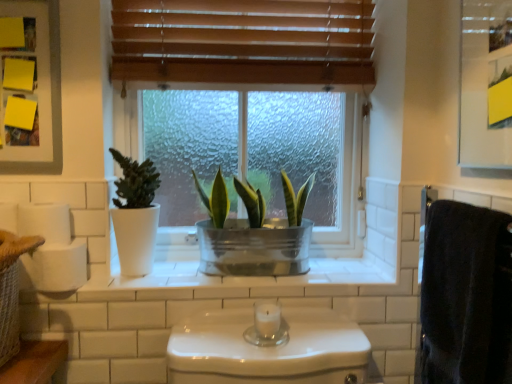
Question: From the image's perspective, is metallic silver medicine cabinet at upper right, acting as the 1th medicine cabinet starting from the right, on white matte toilet paper at left?

Choices:
 (A) no
 (B) yes

Answer: (B)

Question: Considering the relative positions of metallic silver medicine cabinet at upper right, marked as the second medicine cabinet in a back-to-front arrangement, and white matte toilet paper at left in the image provided, is metallic silver medicine cabinet at upper right, marked as the second medicine cabinet in a back-to-front arrangement, to the left of white matte toilet paper at left from the viewer's perspective?

Choices:
 (A) yes
 (B) no

Answer: (B)

Question: Considering the relative sizes of metallic silver medicine cabinet at upper right, marked as the second medicine cabinet in a back-to-front arrangement, and white matte toilet paper at left in the image provided, is metallic silver medicine cabinet at upper right, marked as the second medicine cabinet in a back-to-front arrangement, smaller than white matte toilet paper at left?

Choices:
 (A) yes
 (B) no

Answer: (B)

Question: Is metallic silver medicine cabinet at upper right, which is counted as the first medicine cabinet, starting from the front, positioned before white matte toilet paper at left?

Choices:
 (A) no
 (B) yes

Answer: (B)

Question: From a real-world perspective, is metallic silver medicine cabinet at upper right, which is counted as the first medicine cabinet, starting from the front, physically above white matte toilet paper at left?

Choices:
 (A) yes
 (B) no

Answer: (A)

Question: Does metallic silver medicine cabinet at upper right, acting as the 1th medicine cabinet starting from the right, have a greater height compared to white matte toilet paper at left?

Choices:
 (A) yes
 (B) no

Answer: (A)

Question: From a real-world perspective, does yellow paper at upper left, marked as the first medicine cabinet in a left-to-right arrangement, stand above white matte toilet paper at left?

Choices:
 (A) no
 (B) yes

Answer: (B)

Question: Considering the relative sizes of yellow paper at upper left, arranged as the first medicine cabinet when viewed from the back, and white matte toilet paper at left in the image provided, is yellow paper at upper left, arranged as the first medicine cabinet when viewed from the back, thinner than white matte toilet paper at left?

Choices:
 (A) yes
 (B) no

Answer: (A)

Question: Considering the relative sizes of yellow paper at upper left, arranged as the first medicine cabinet when viewed from the back, and white matte toilet paper at left in the image provided, is yellow paper at upper left, arranged as the first medicine cabinet when viewed from the back, wider than white matte toilet paper at left?

Choices:
 (A) no
 (B) yes

Answer: (A)

Question: Is white matte toilet paper at left located within yellow paper at upper left, arranged as the first medicine cabinet when viewed from the back?

Choices:
 (A) yes
 (B) no

Answer: (B)

Question: From the image's perspective, is yellow paper at upper left, arranged as the first medicine cabinet when viewed from the back, on top of white matte toilet paper at left?

Choices:
 (A) yes
 (B) no

Answer: (A)

Question: Does metallic green plant at center, the first houseplant positioned from the right, come in front of yellow paper at upper left, which is the second medicine cabinet from right to left?

Choices:
 (A) no
 (B) yes

Answer: (A)